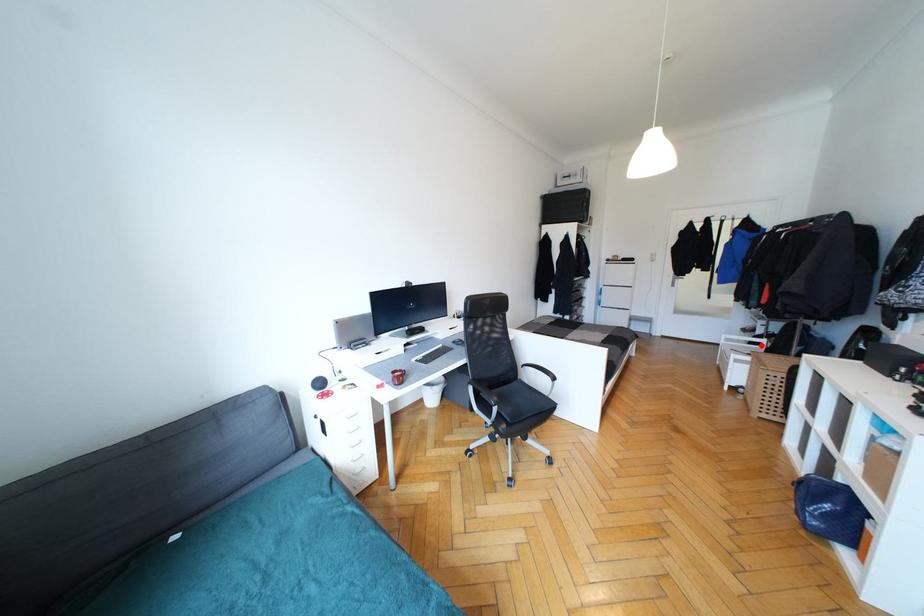
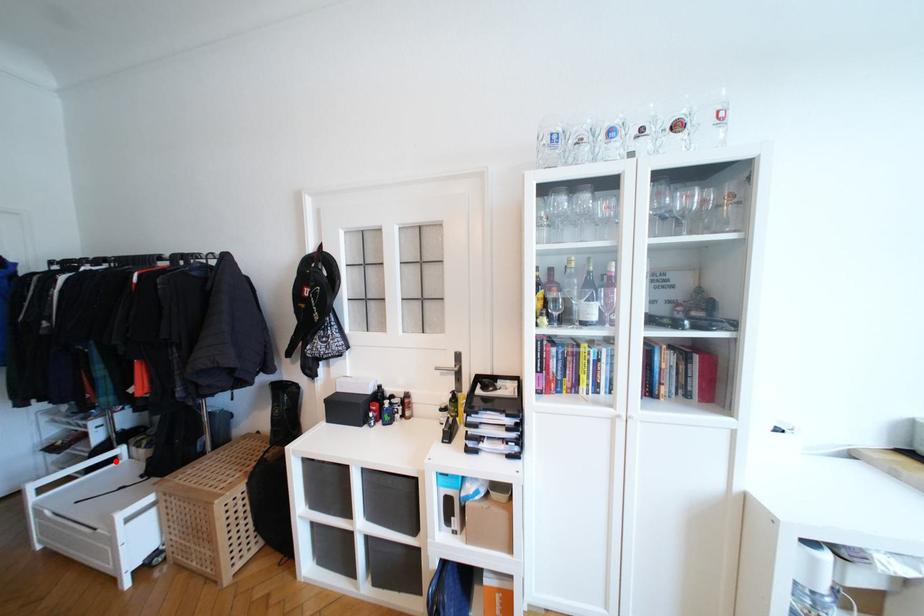
I am providing you with two images of the same scene from different viewpoints. A red point is marked on the first image and another point is marked on the second image. Do the highlighted points in image1 and image2 indicate the same real-world spot?

Yes